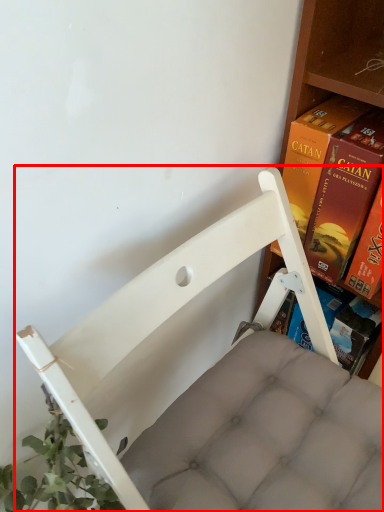
Question: From the image's perspective, where is furniture (annotated by the red box) located relative to book?

Choices:
 (A) above
 (B) below

Answer: (B)